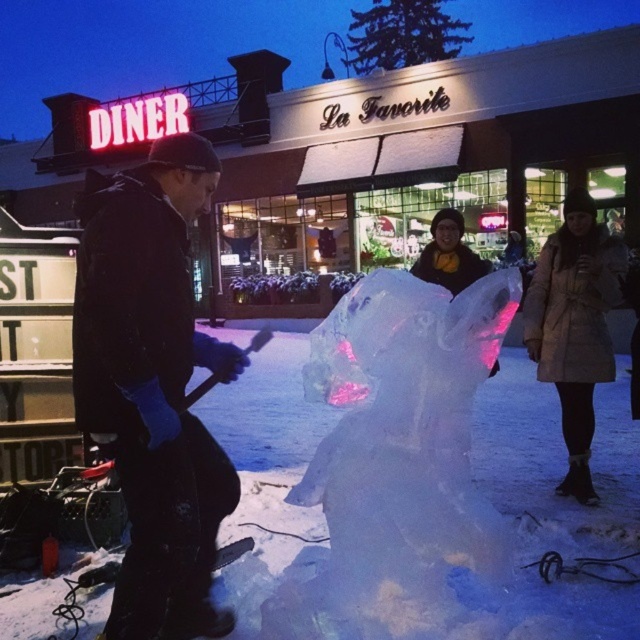
You are standing at the entrance of La Favorite diner and want to take a photo of the snow sculpture being carved by the person in the foreground. The camera you have can only focus on objects within 7 feet. Is the point at coordinate point (x=157, y=592) within the camera focus range?

The distance of point (x=157, y=592) from camera is 6.86 feet, which is within the camera focus range of 7 feet. Therefore, the camera can focus on the point at coordinate point (x=157, y=592).

You are a photographer standing in front of the diner and want to take a photo of both the black matte jacket at left and beige down coat at right. Which jacket should you focus on first if you want to capture them both in the frame?

The black matte jacket at left is positioned on the left side of beige down coat at right, so you should focus on the black matte jacket at left first to ensure both are in the frame.